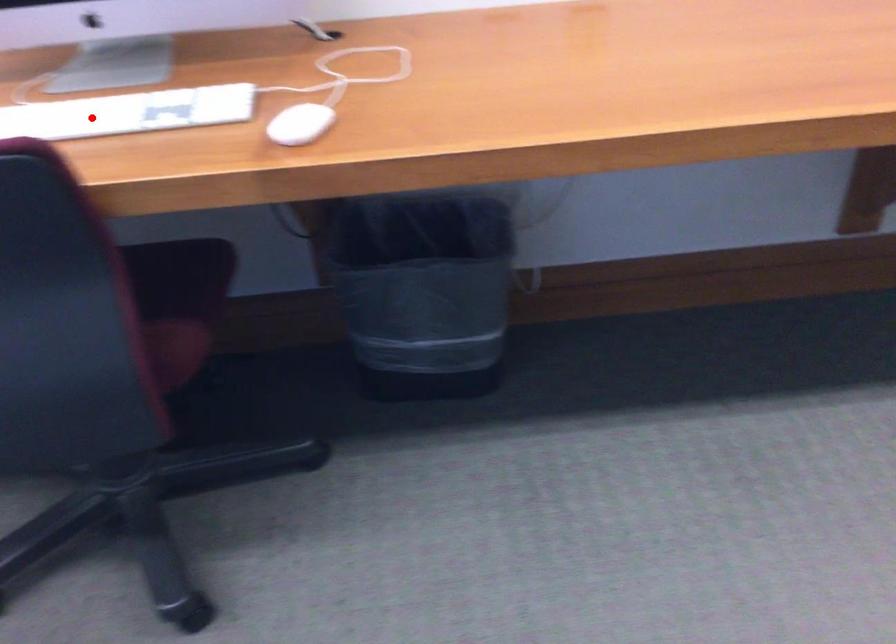
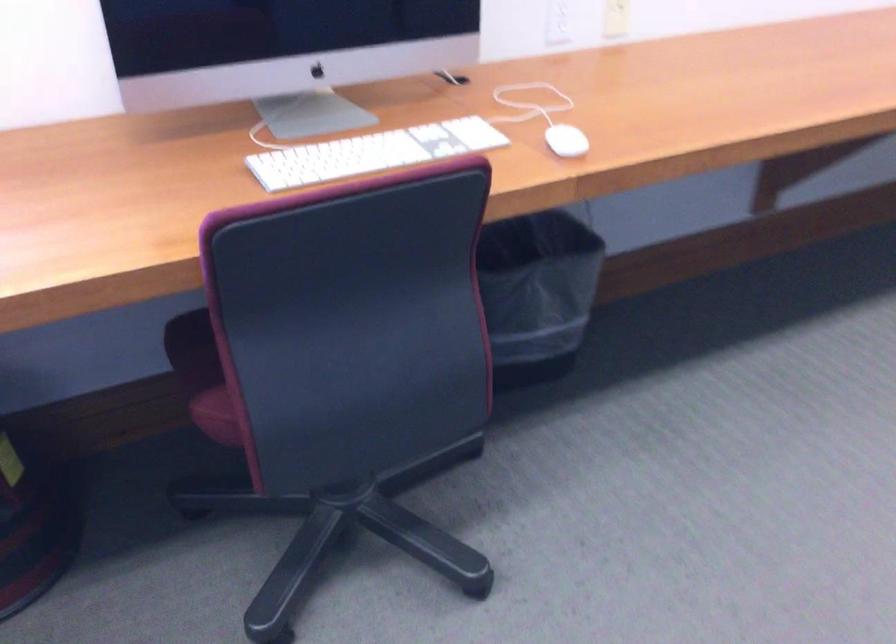
Find the pixel in the second image that matches the highlighted location in the first image.

(372, 153)